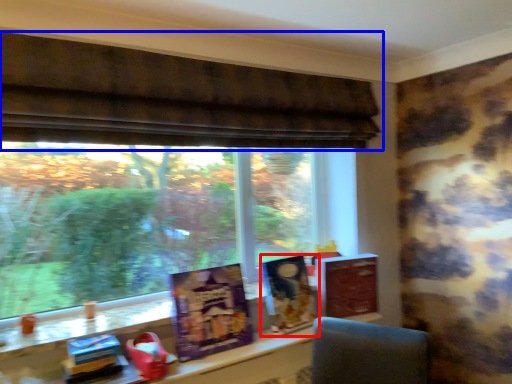
Question: Which point is closer to the camera, book cover (highlighted by a red box) or window (highlighted by a blue box)?

Choices:
 (A) book cover
 (B) window

Answer: (B)